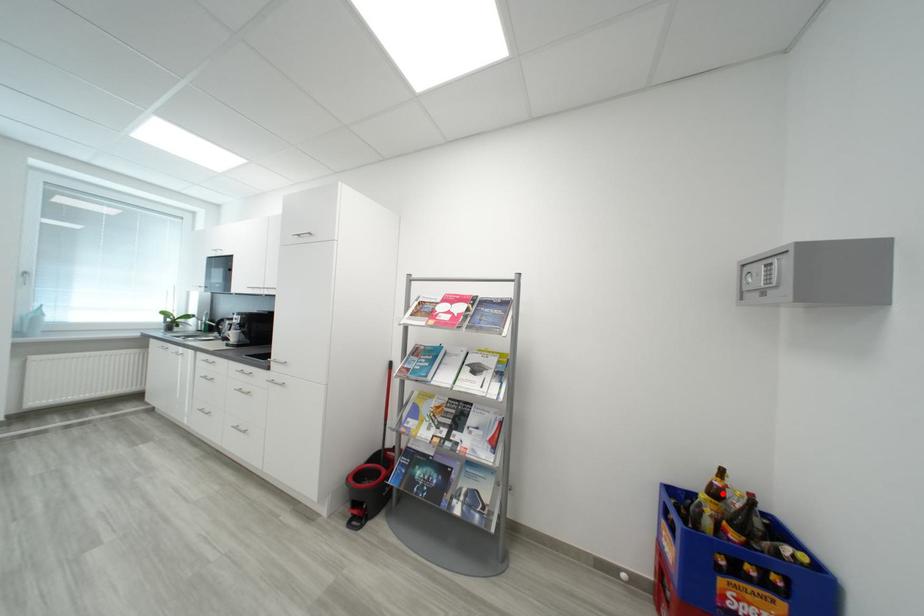
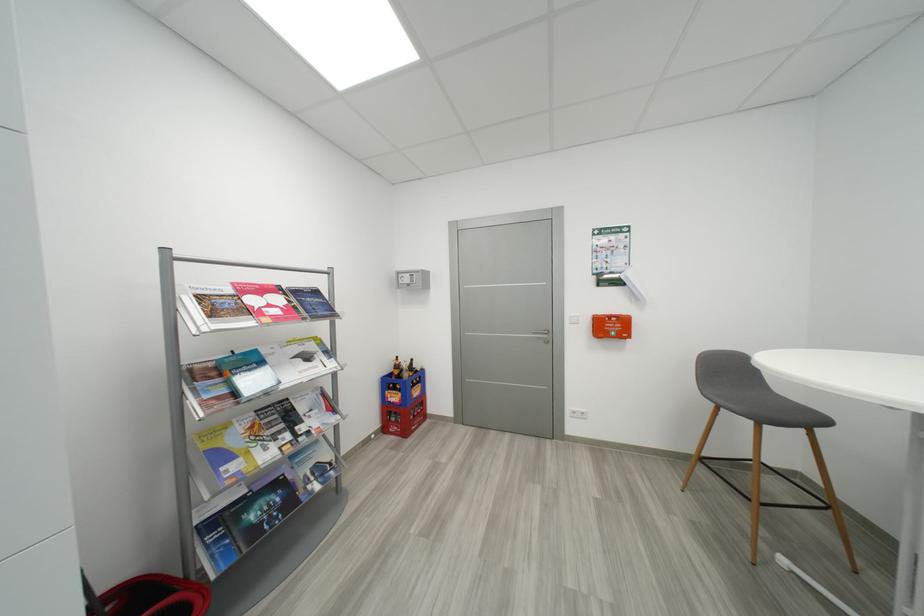
Where in the second image is the point corresponding to the highlighted location from the first image?

(404, 369)